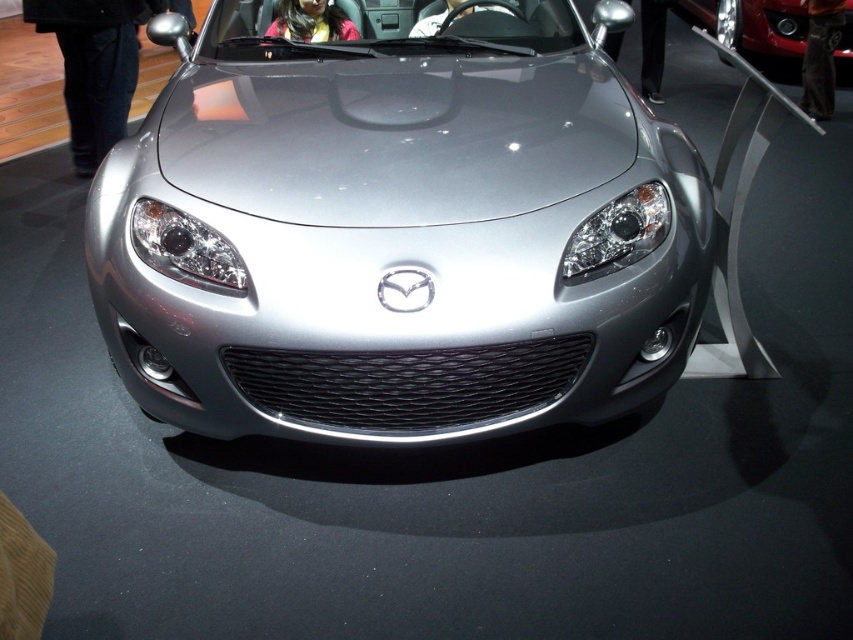
Between point (788, 45) and point (287, 29), which one is positioned in front?

Point (287, 29)

Who is positioned more to the left, metallic silver car at center or satin silver car at center?

satin silver car at center is more to the left.

Does point (749, 26) lie behind point (341, 29)?

Yes.

This screenshot has width=853, height=640. What are the coordinates of `metallic silver car at center` in the screenshot? It's located at (753, 26).